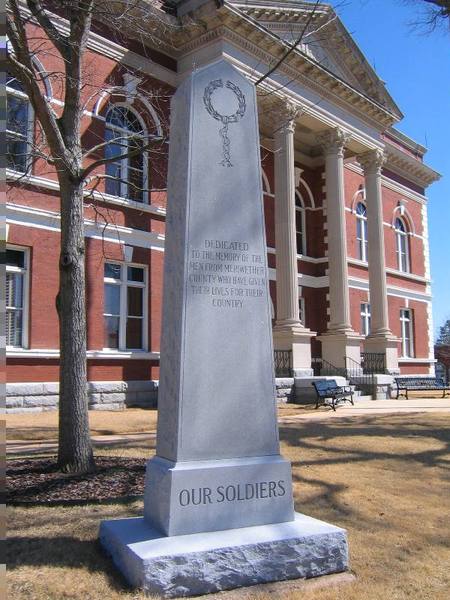
Find the location of `window`. window is located at coordinates (137, 165), (18, 129), (15, 294), (136, 300), (367, 319), (301, 303), (301, 230), (362, 235), (402, 245), (406, 338).